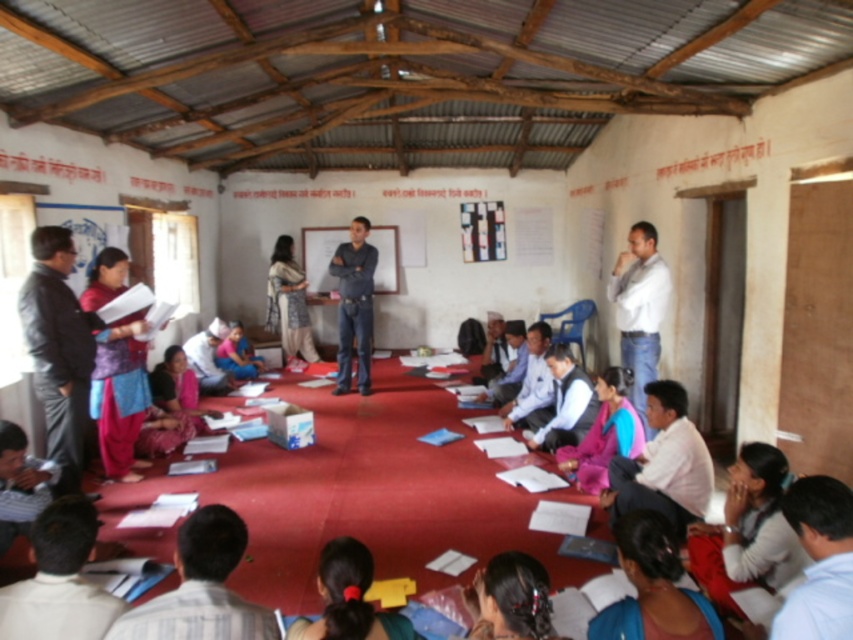
Is white shirt at upper right further to camera compared to dark blue jeans at center?

No, white shirt at upper right is in front of dark blue jeans at center.

Between point (625, 348) and point (372, 248), which one is positioned in front?

Point (625, 348)

Is point (656, 312) positioned behind point (363, 310)?

No, it is not.

What are the coordinates of `white shirt at upper right` in the screenshot? It's located at (639, 308).